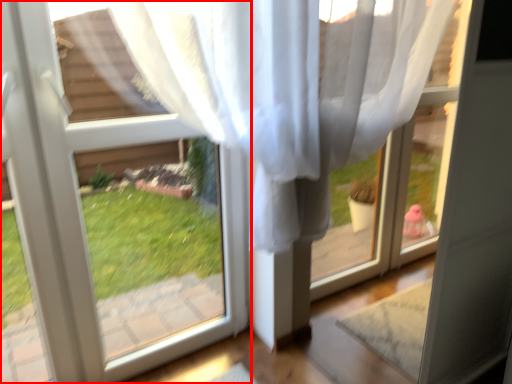
Question: From the image, what is the correct spatial relationship of window (annotated by the red box) in relation to window frame?

Choices:
 (A) right
 (B) left

Answer: (B)